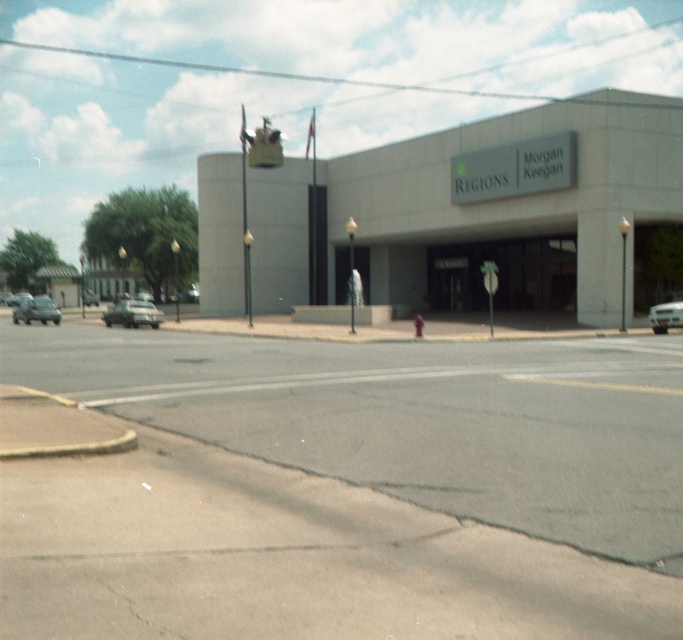
You are a parking attendant and need to fit both the shiny silver sedan at left and the silver metallic car at right into a parking spot that can accommodate a car 5 meters wide. Which car should you park first to ensure both fit?

The shiny silver sedan at left is wider than the silver metallic car at right. Since the parking spot can only accommodate a car 5 meters wide, you should park the narrower silver metallic car at right first, then the wider shiny silver sedan at left might not fit. However, since the total width required for both exceeds the spot, it might not be possible. Please check the exact widths.

You are a pedestrian standing on the sidewalk near the Regions Morgan Keegan building. You see a silver metallic sedan at left and a silver metallic car at right. Which car is closer to you?

The silver metallic sedan at left is closer to you because it is positioned further to the viewer than the silver metallic car at right.

You are a pedestrian standing on the sidewalk and want to cross the street. You see a shiny silver sedan at left and a silver metallic car at right. Which car is closer to your left side?

The shiny silver sedan at left is positioned on the left side of silver metallic car at right, so the shiny silver sedan at left is closer to your left side.